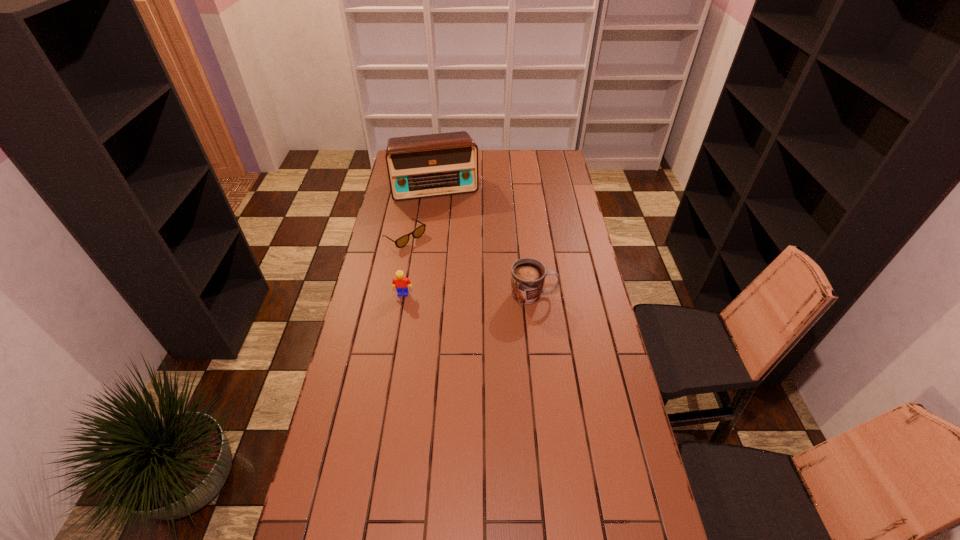
In order to click on Lego in this screenshot , I will do [400, 282].

The width and height of the screenshot is (960, 540). I want to click on mug, so click(x=528, y=275).

Locate an element on the screen. the second farthest object is located at coordinates (419, 231).

Image resolution: width=960 pixels, height=540 pixels. I want to click on sunglasses, so click(419, 231).

Locate an element on the screen. This screenshot has width=960, height=540. the tallest object is located at coordinates (431, 165).

Locate an element on the screen. This screenshot has height=540, width=960. radio receiver is located at coordinates (431, 165).

Locate an element on the screen. vacant space situated on the front-facing side of the Lego is located at coordinates (395, 346).

I want to click on vacant space located 0.050m on the side of the rightmost object with the handle, so click(x=570, y=295).

Find the location of a particular element. The image size is (960, 540). vacant space situated on the front-facing side of the third nearest object is located at coordinates (457, 274).

Where is `free location located on the front-facing side of the third nearest object`? free location located on the front-facing side of the third nearest object is located at coordinates 480,291.